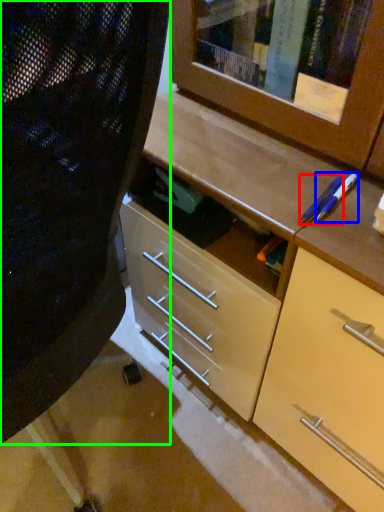
Question: Considering the real-world distances, which object is farthest from pencil (highlighted by a red box)? pencil (highlighted by a blue box) or folding chair (highlighted by a green box)?

Choices:
 (A) pencil
 (B) folding chair

Answer: (B)